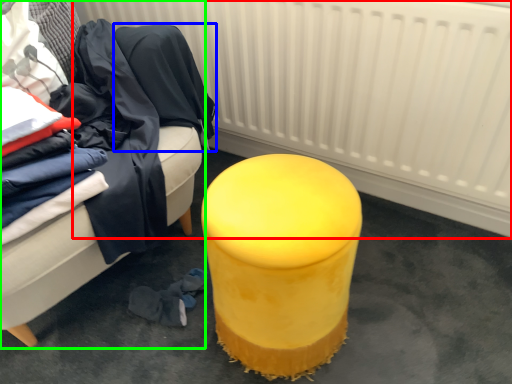
Question: Considering the real-world distances, which object is closest to radiator (highlighted by a red box)? clothing (highlighted by a blue box) or furniture (highlighted by a green box).

Choices:
 (A) clothing
 (B) furniture

Answer: (A)